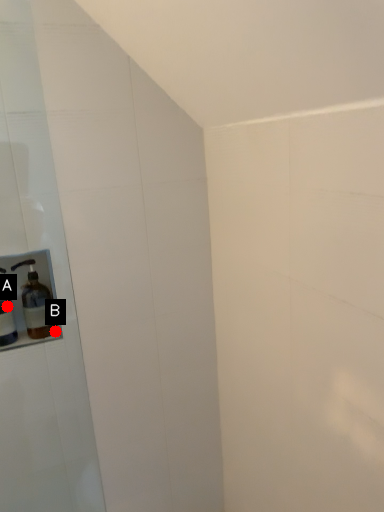
Question: Two points are circled on the image, labeled by A and B beside each circle. Which point is closer to the camera?

Choices:
 (A) A is closer
 (B) B is closer

Answer: (A)